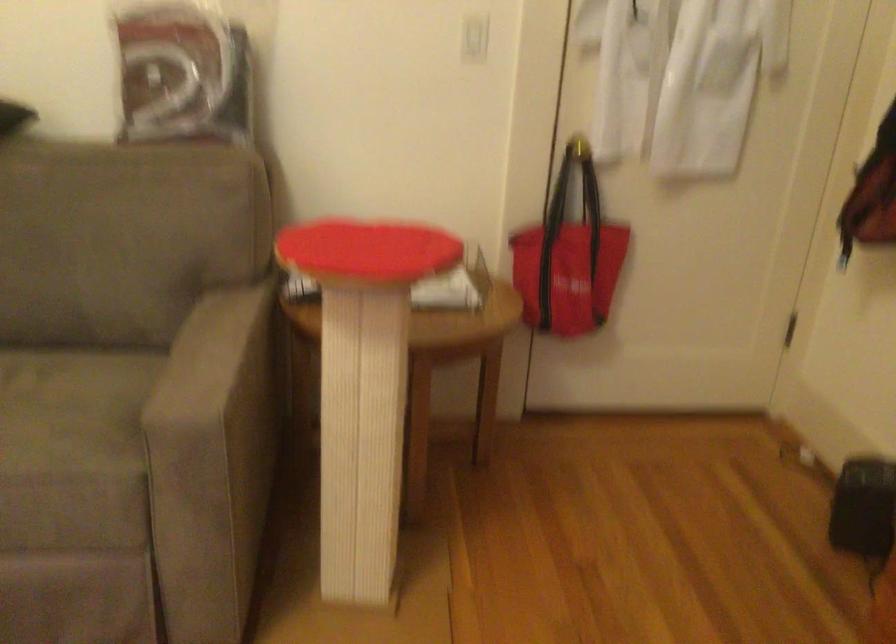
Find where to push the white light switch. Please return your answer as a coordinate pair (x, y).

(474, 38)